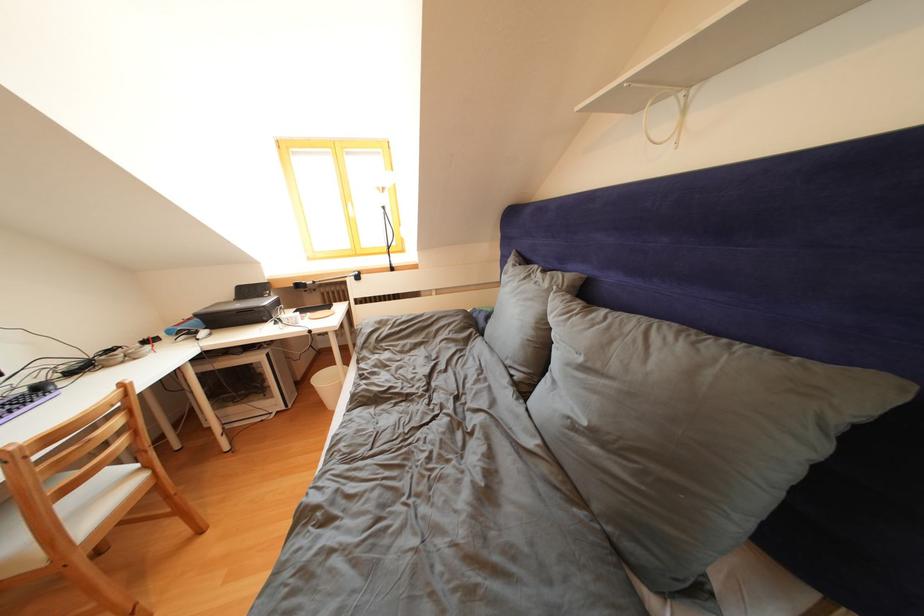
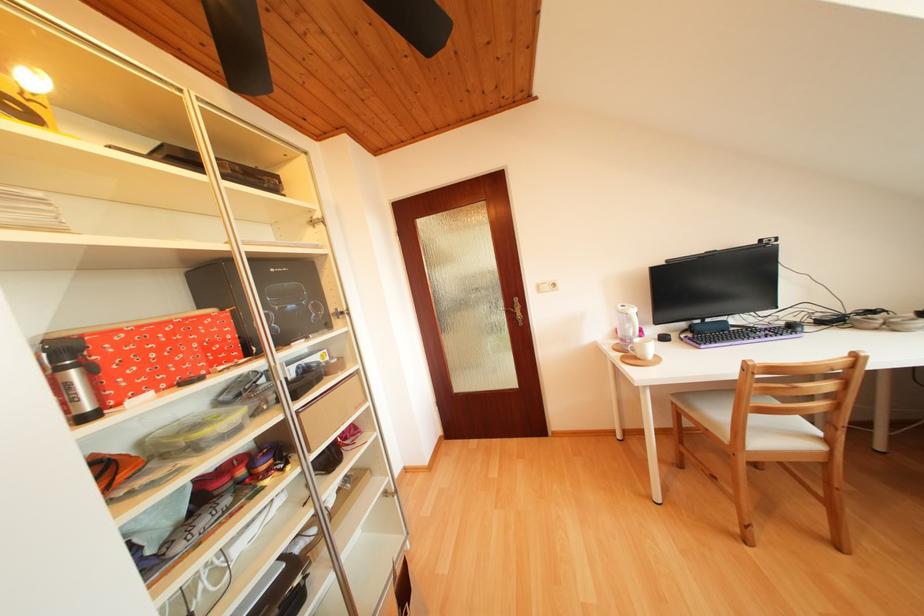
Locate, in the second image, the point that corresponds to point 210,537 in the first image.

(847, 553)